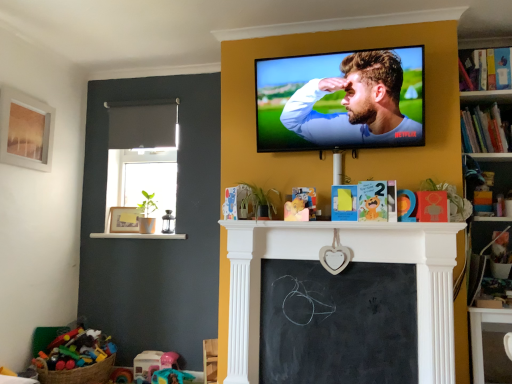
Locate an element on the screen. The width and height of the screenshot is (512, 384). vacant point above black chalkboard at center (from a real-world perspective) is located at coordinates (335, 261).